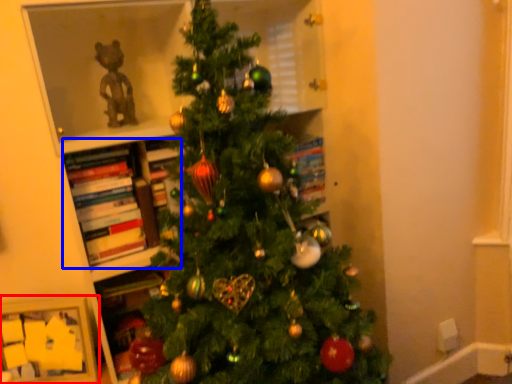
Question: Among these objects, which one is farthest to the camera, picture frame (highlighted by a red box) or book (highlighted by a blue box)?

Choices:
 (A) picture frame
 (B) book

Answer: (A)